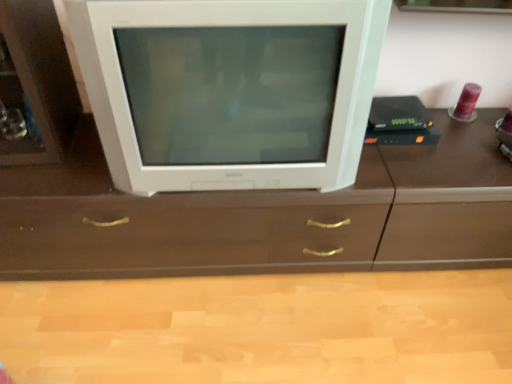
Question: Considering the relative sizes of brown wood counter top at center and white glossy television at center in the image provided, is brown wood counter top at center shorter than white glossy television at center?

Choices:
 (A) no
 (B) yes

Answer: (B)

Question: Considering the relative sizes of brown wood counter top at center and white glossy television at center in the image provided, is brown wood counter top at center bigger than white glossy television at center?

Choices:
 (A) yes
 (B) no

Answer: (B)

Question: From the image's perspective, is brown wood counter top at center on top of white glossy television at center?

Choices:
 (A) no
 (B) yes

Answer: (A)

Question: Is brown wood counter top at center surrounding white glossy television at center?

Choices:
 (A) no
 (B) yes

Answer: (A)

Question: From a real-world perspective, is brown wood counter top at center positioned over white glossy television at center based on gravity?

Choices:
 (A) no
 (B) yes

Answer: (A)

Question: Is brown wood counter top at center oriented towards white glossy television at center?

Choices:
 (A) no
 (B) yes

Answer: (A)

Question: From a real-world perspective, is white glossy television at center under brown wood counter top at center?

Choices:
 (A) yes
 (B) no

Answer: (B)

Question: Is brown wood counter top at center located within white glossy television at center?

Choices:
 (A) yes
 (B) no

Answer: (B)

Question: From the image's perspective, would you say white glossy television at center is shown under brown wood counter top at center?

Choices:
 (A) no
 (B) yes

Answer: (A)

Question: Is white glossy television at center closer to camera compared to brown wood counter top at center?

Choices:
 (A) yes
 (B) no

Answer: (A)

Question: Is white glossy television at center far away from brown wood counter top at center?

Choices:
 (A) no
 (B) yes

Answer: (A)

Question: Is white glossy television at center at the left side of brown wood counter top at center?

Choices:
 (A) no
 (B) yes

Answer: (B)

Question: In terms of size, does brown wood counter top at center appear bigger or smaller than white glossy television at center?

Choices:
 (A) small
 (B) big

Answer: (A)